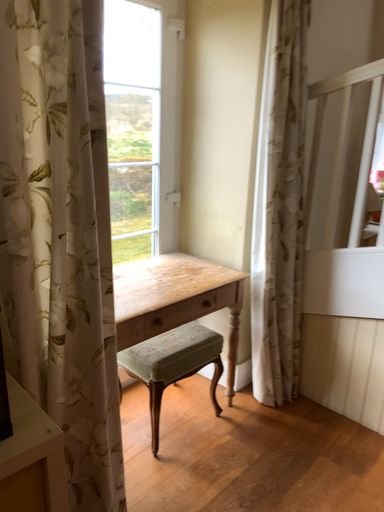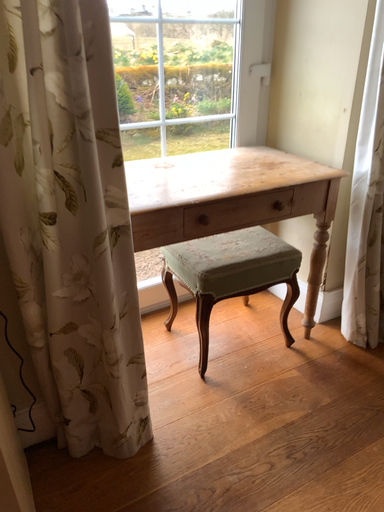
Question: How did the camera likely rotate when shooting the video?

Choices:
 (A) rotated upward
 (B) rotated downward

Answer: (B)